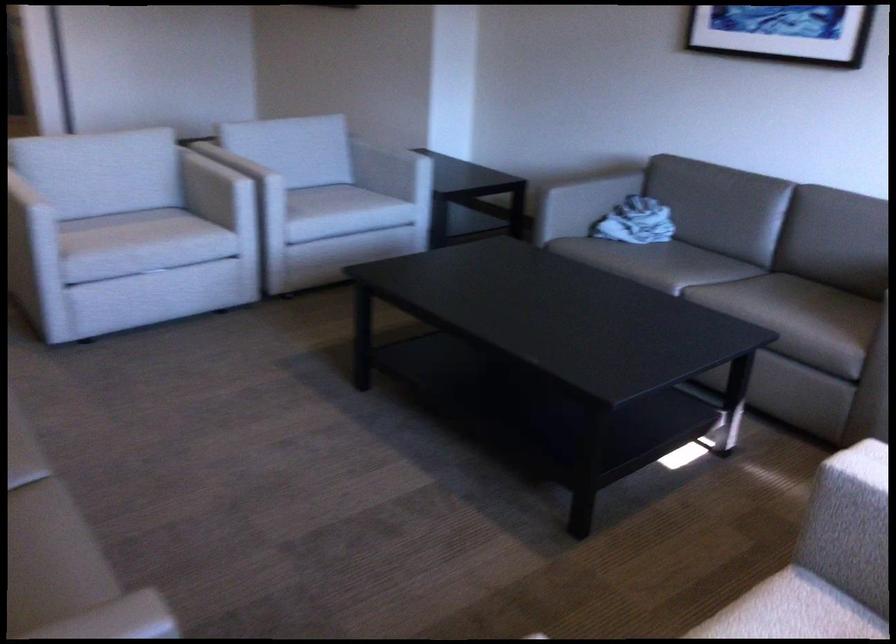
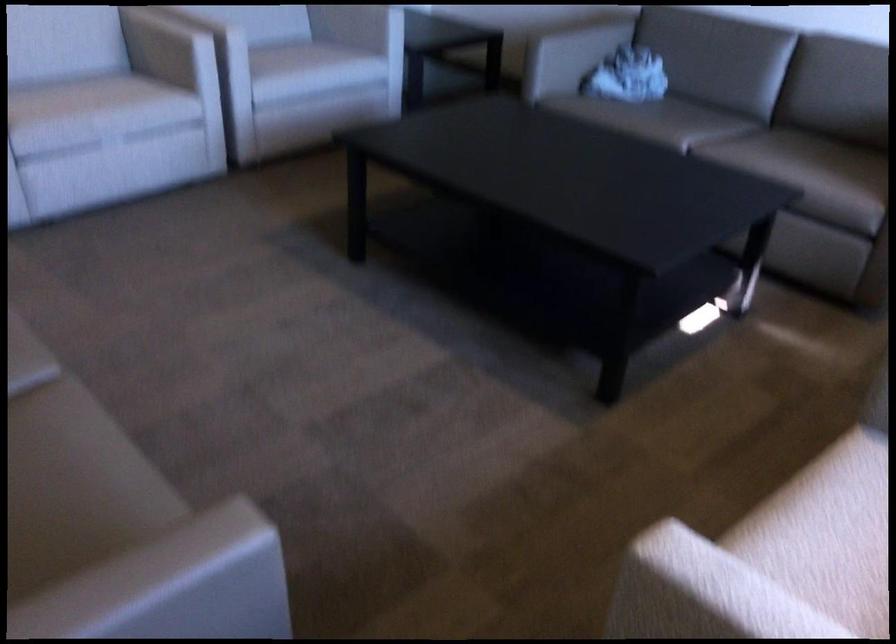
Where in the second image is the point corresponding to (713,275) from the first image?

(714, 127)